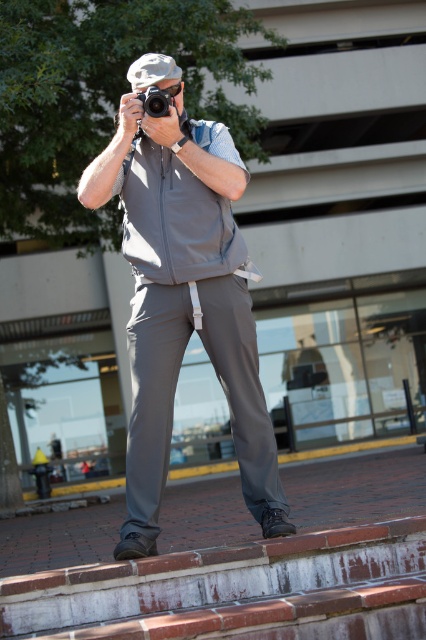
Which is more to the left, gray matte vest at center or matte black camera at center?

matte black camera at center

Does gray matte vest at center have a greater width compared to matte black camera at center?

Indeed, gray matte vest at center has a greater width compared to matte black camera at center.

Who is more forward, (132,317) or (158,104)?

Point (158,104)

Identify the location of gray matte vest at center. The width and height of the screenshot is (426, 640). (183, 294).